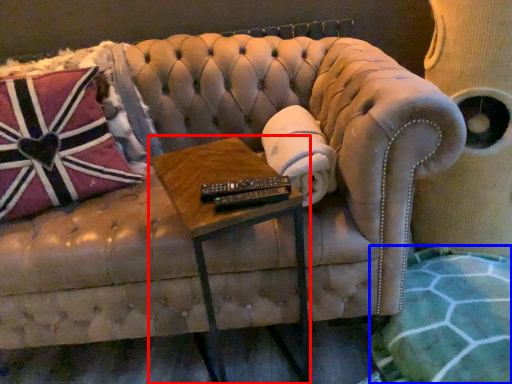
Question: Among these objects, which one is nearest to the camera, table (highlighted by a red box) or blanket (highlighted by a blue box)?

Choices:
 (A) table
 (B) blanket

Answer: (A)